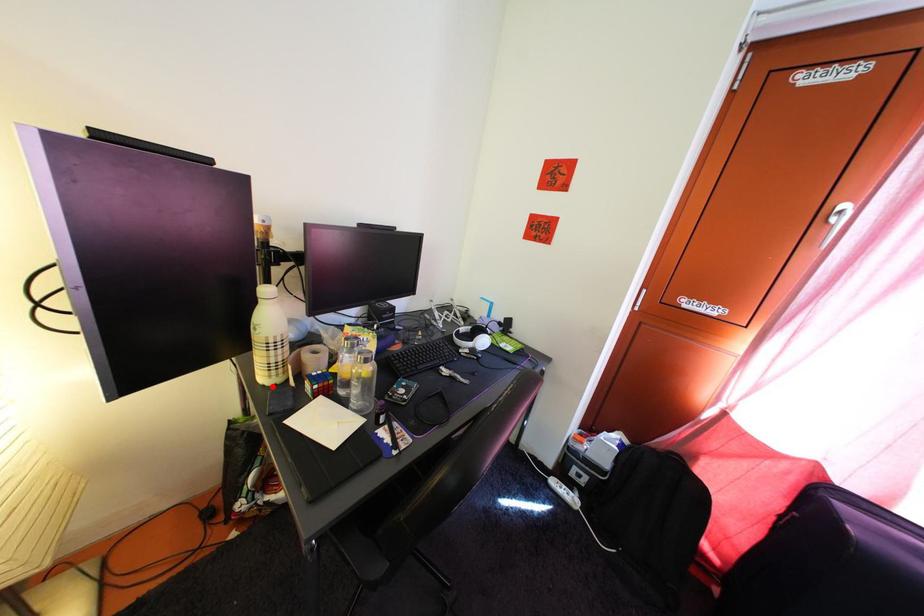
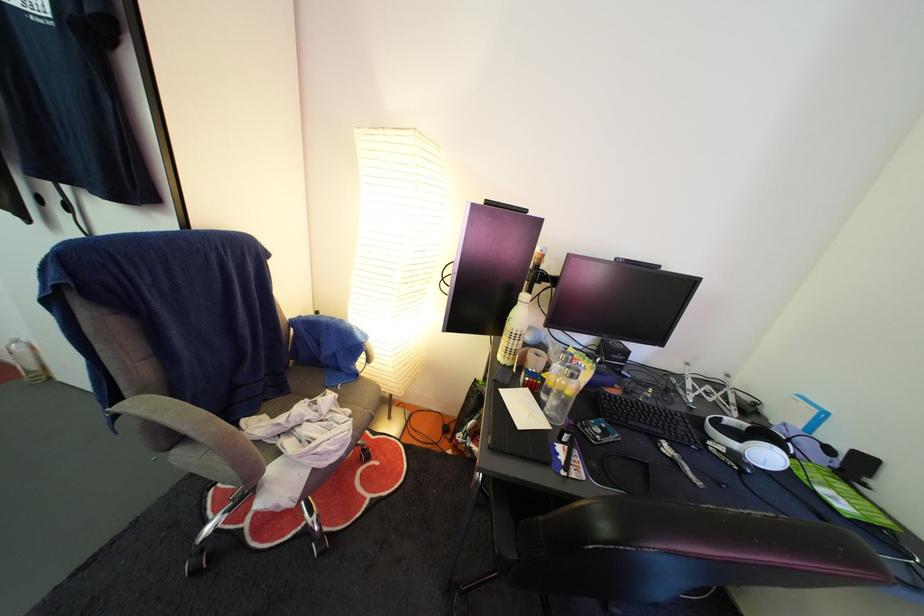
The point at the highlighted location is marked in the first image. Where is the corresponding point in the second image?

(509, 365)